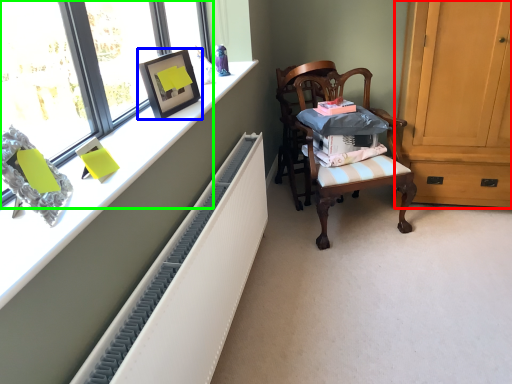
Question: Based on their relative distances, which object is nearer to cabinetry (highlighted by a red box)? Choose from picture frame (highlighted by a blue box) and window (highlighted by a green box).

Choices:
 (A) picture frame
 (B) window

Answer: (A)